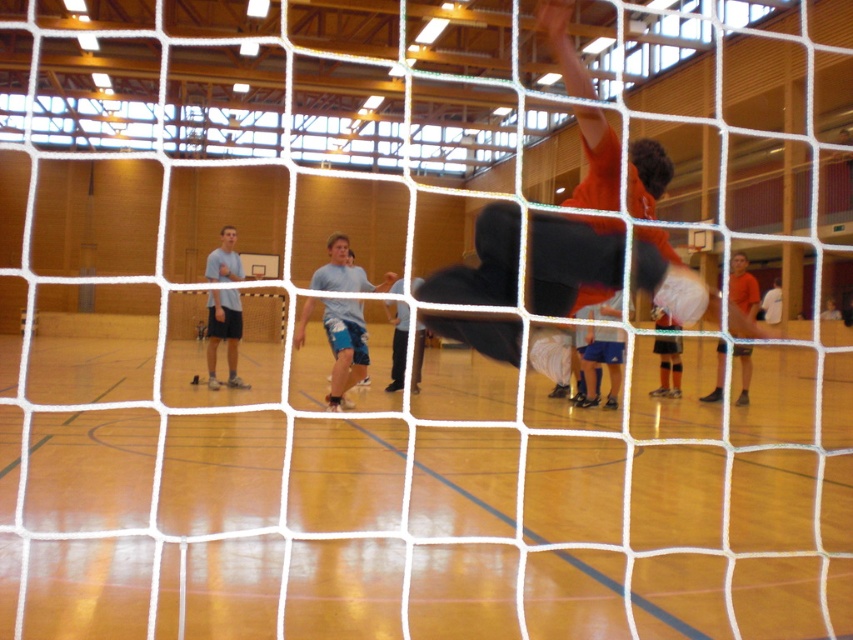
Which is more to the right, orange jersey at upper right or orange jersey shorts at center?

From the viewer's perspective, orange jersey shorts at center appears more on the right side.

Who is more distant from viewer, (531, 285) or (602, 340)?

Positioned behind is point (602, 340).

The image size is (853, 640). In order to click on orange jersey at upper right in this screenshot , I will do `click(573, 260)`.

How far apart are orange jersey at upper right and orange jersey at right?

orange jersey at upper right is 28.04 feet away from orange jersey at right.

Which is more to the right, orange jersey at upper right or orange jersey at right?

From the viewer's perspective, orange jersey at right appears more on the right side.

Which is in front, point (732, 307) or point (735, 298)?

Positioned in front is point (732, 307).

Find the location of a particular element. The height and width of the screenshot is (640, 853). orange jersey at upper right is located at coordinates [x=573, y=260].

Who is lower down, light blue cotton shorts at center or light blue shorts at center?

light blue shorts at center is lower down.

What do you see at coordinates (344, 348) in the screenshot? This screenshot has width=853, height=640. I see `light blue cotton shorts at center` at bounding box center [344, 348].

You are a GUI agent. You are given a task and a screenshot of the screen. Output one action in this format:
    pyautogui.click(x=<x>, y=<y>)
    Task: Click on the light blue cotton shorts at center
    This screenshot has width=853, height=640.
    Given the screenshot: What is the action you would take?
    pyautogui.click(x=344, y=348)